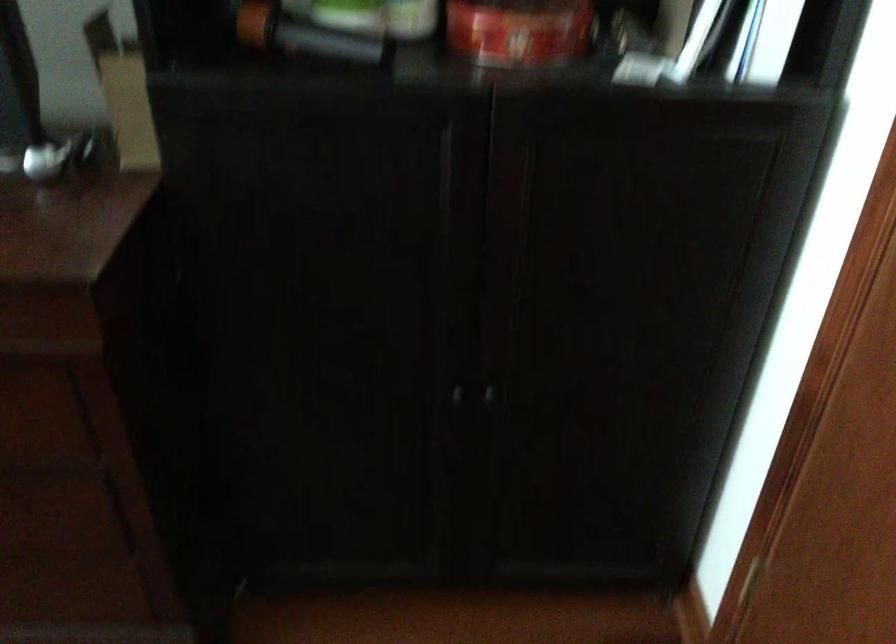
I want to click on red metal can, so click(519, 31).